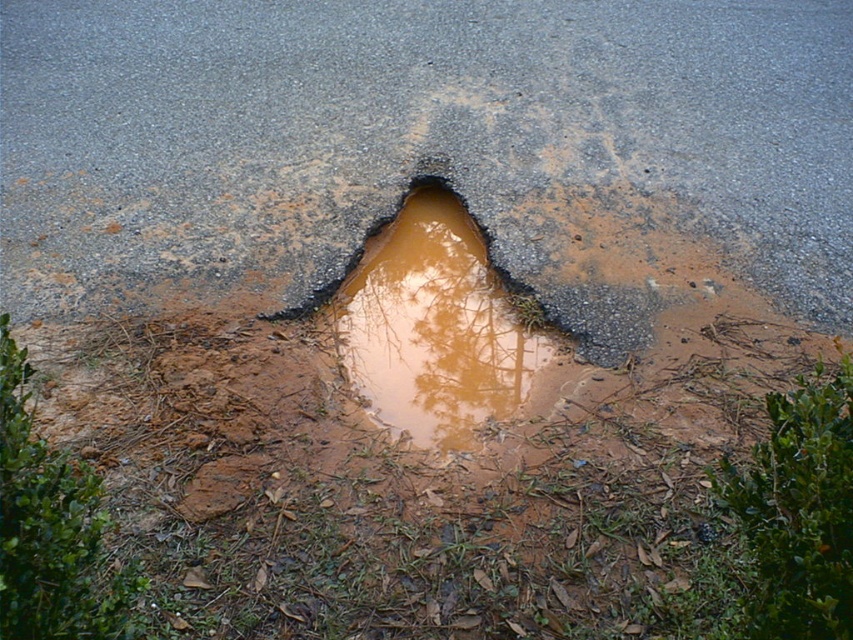
You are a gardener who needs to trim both the green leafy bush at lower right and the green leafy tree at lower left. Which one do you think will require more time and effort due to its size?

The green leafy bush at lower right is bigger than the green leafy tree at lower left, so it will require more time and effort to trim.

You are a delivery robot navigating a road with a pothole filled with brownish water. You have two points to consider for your path planning. The first point is at coordinates point (828, 595), and the second is at point (24, 611). Which point is closer to you as you approach the pothole?

Point (828, 595) is closer to the viewer than point (24, 611), so the delivery robot should choose that point as it is nearer.

You are a gardener assessing the scene. You notice the green leafy bush at lower right and the green leafy tree at lower left. Which one has a greater height?

The green leafy bush at lower right is taller than the green leafy tree at lower left.